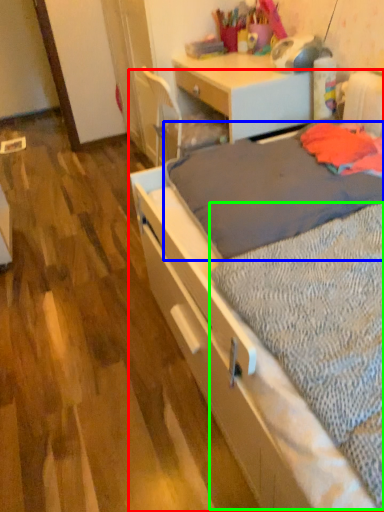
Question: Which object is the closest to the bed (highlighted by a red box)? Choose among these: blanket (highlighted by a blue box) or sheet (highlighted by a green box).

Choices:
 (A) blanket
 (B) sheet

Answer: (B)